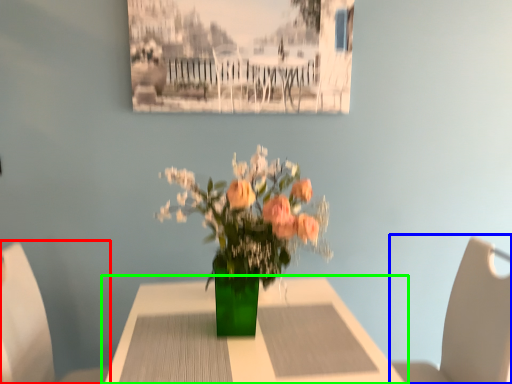
Question: Which object is positioned closest to chair (highlighted by a red box)? Select from chair (highlighted by a blue box) and table (highlighted by a green box).

Choices:
 (A) chair
 (B) table

Answer: (B)